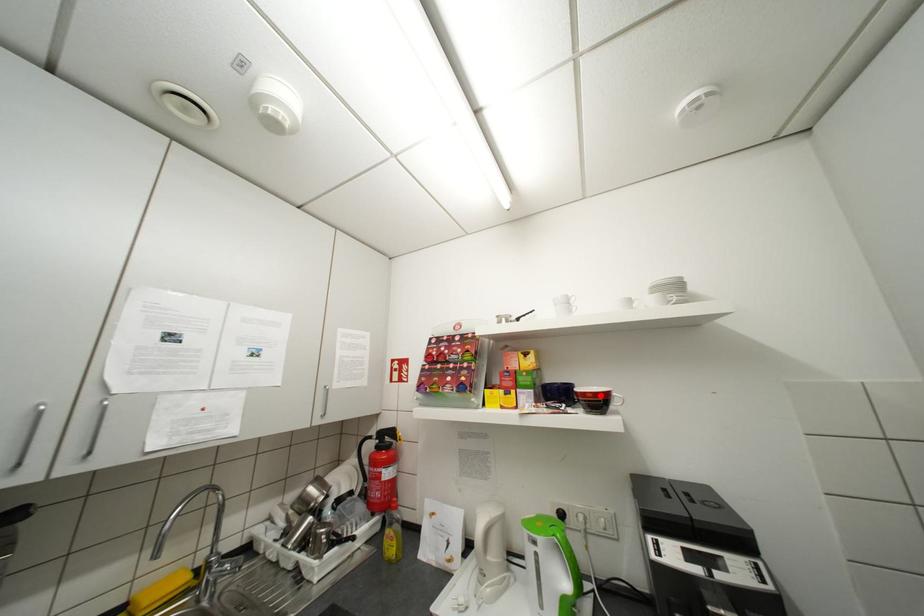
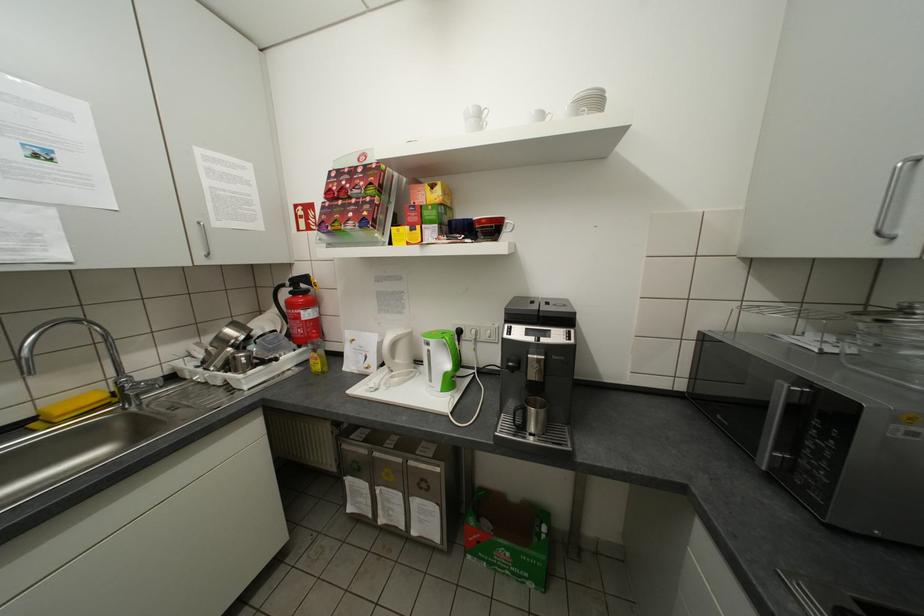
Find the pixel in the second image that matches the highlighted location in the first image.

(494, 222)